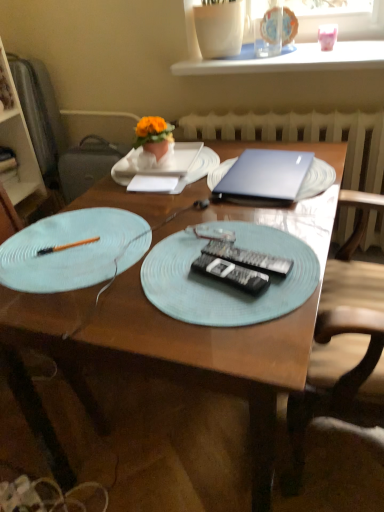
Identify the location of vacant space that's between black plastic remote control at center, marked as the 1th remote control in a bottom-to-top arrangement, and white paper at center. Image resolution: width=384 pixels, height=512 pixels. (184, 221).